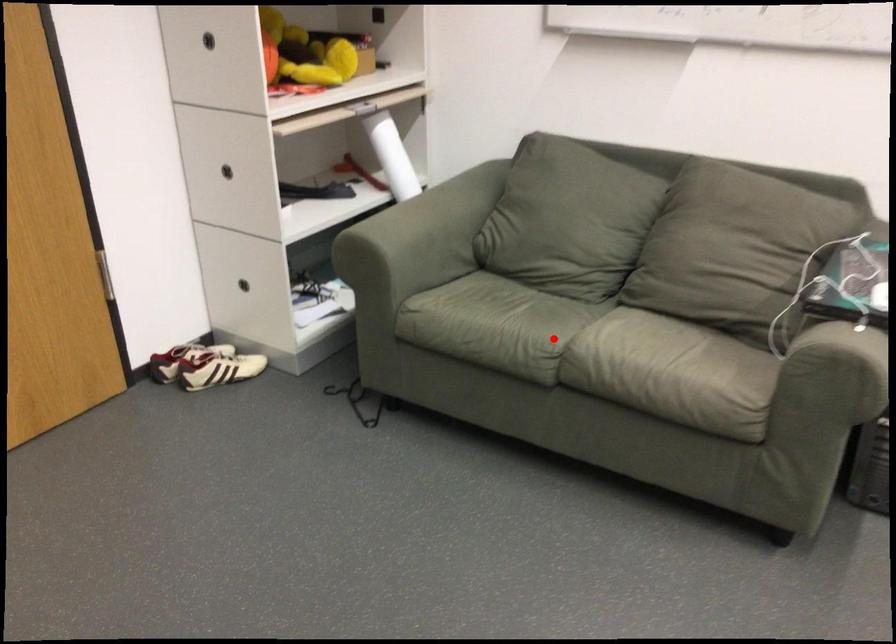
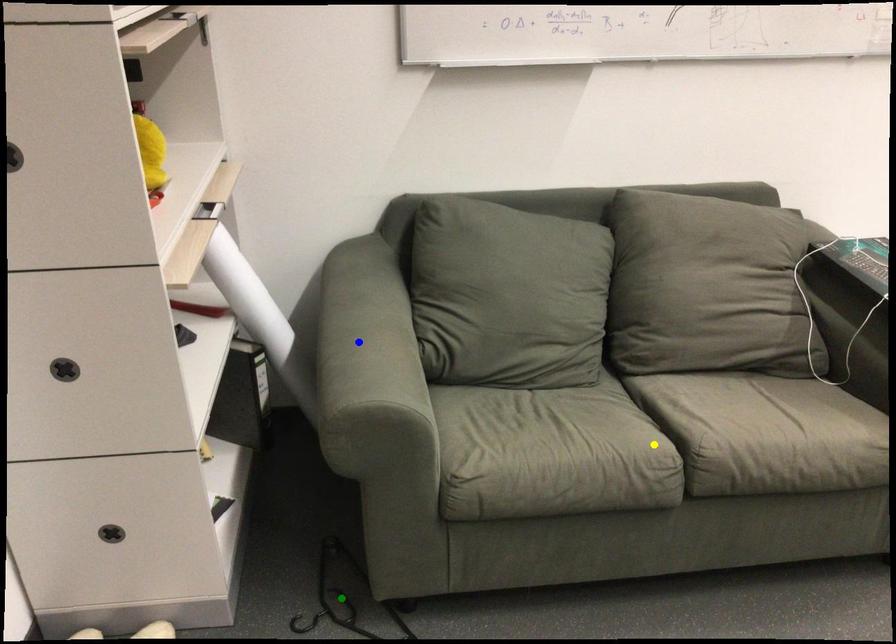
Question: I am providing you with two images of the same scene from different viewpoints. A red point is marked on the first image. You are given multiple points on the second image. Which point in image 2 represents the same 3d spot as the red point in image 1?

Choices:
 (A) green point
 (B) yellow point
 (C) blue point

Answer: (B)